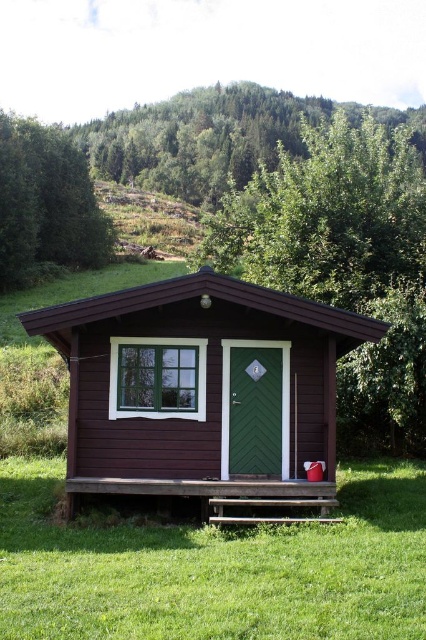
You are standing in front of the cabin and want to take a photo of both the dark brown wood cabin at center and the green textured tree at upper left. Which direction should you face to include both in your photo?

You should face towards the left to include both the dark brown wood cabin at center and the green textured tree at upper left in your photo, since the dark brown wood cabin at center is positioned to the right of the green textured tree at upper left.

You are standing in front of the cabin and notice two trees in the scene. Which tree is closer to the cabin? The green wood tree at center or the green leafy tree at upper center?

The green wood tree at center is positioned on the right side of green leafy tree at upper center, meaning the green leafy tree at upper center is closer to the cabin.